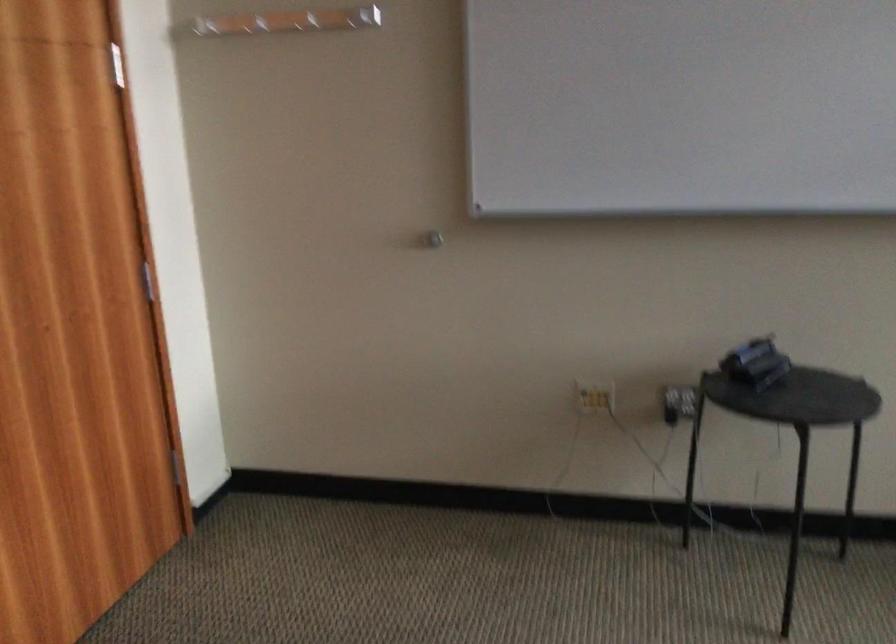
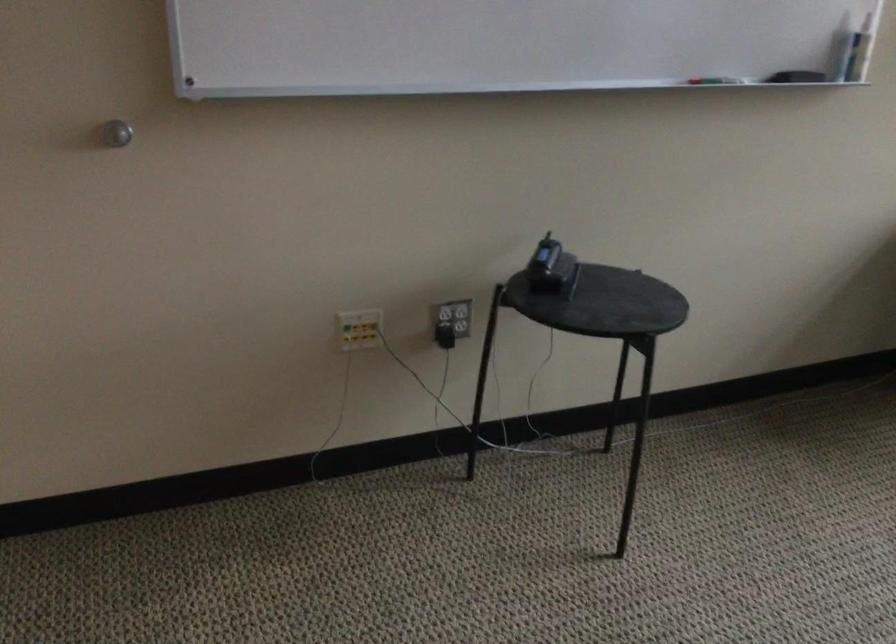
Locate, in the second image, the point that corresponds to pixel 668 410 in the first image.

(444, 336)